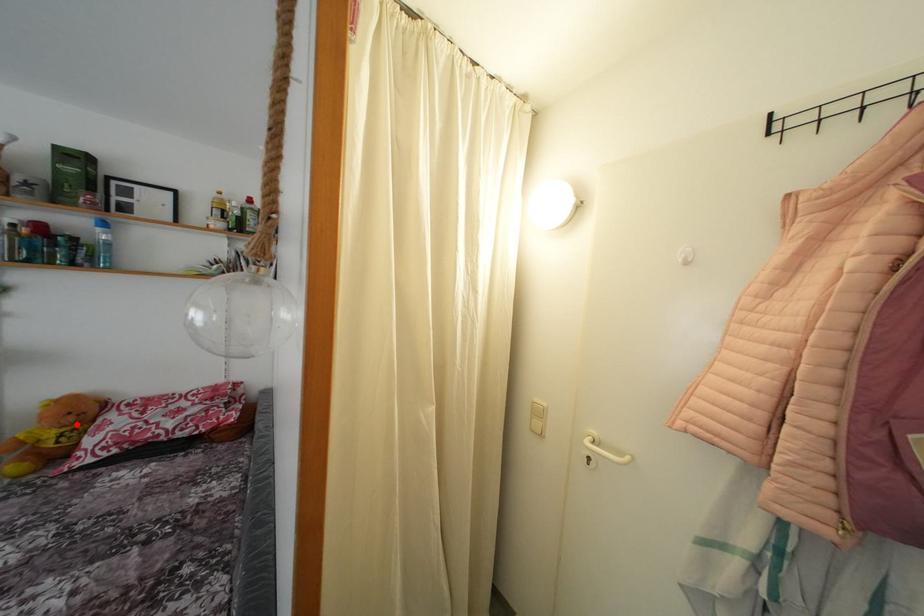
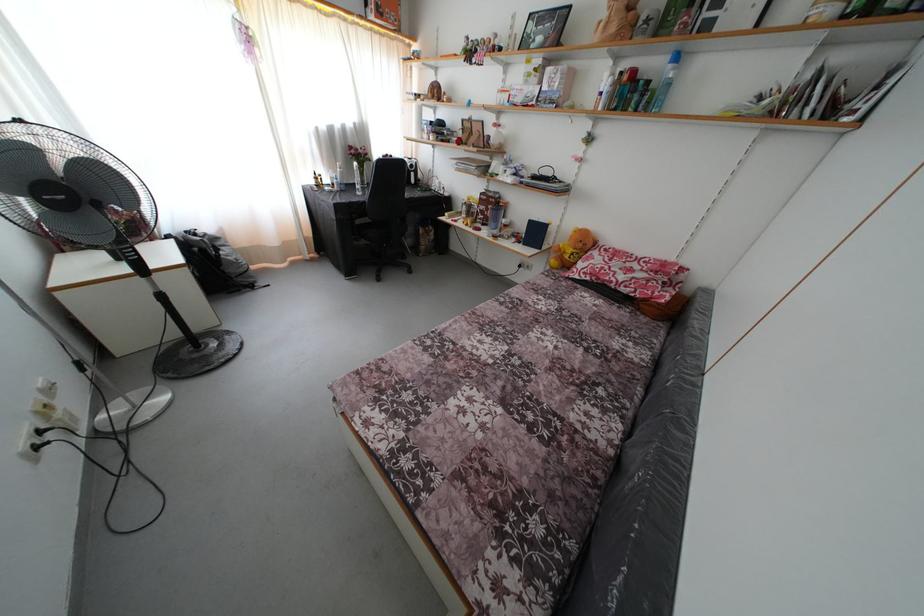
The point at the highlighted location is marked in the first image. Where is the corresponding point in the second image?

(585, 251)